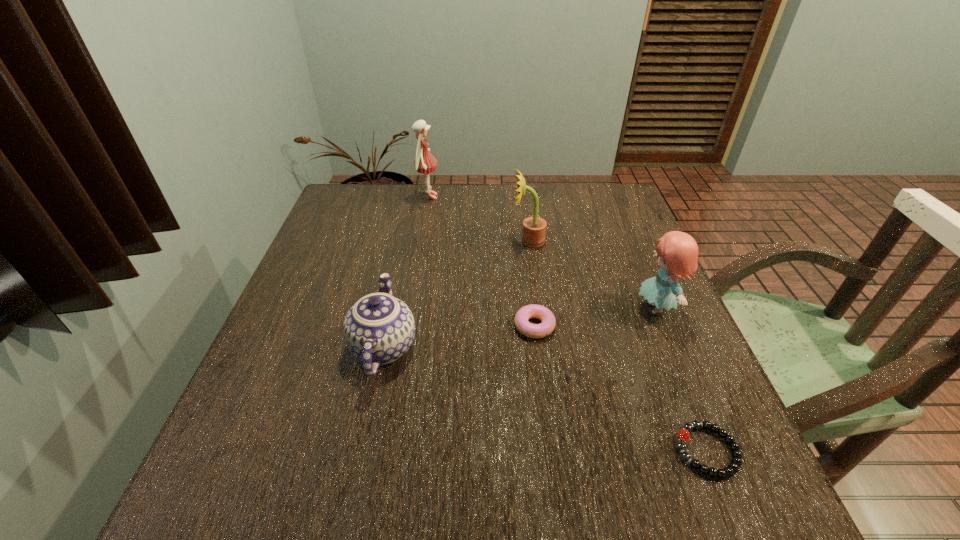
This screenshot has width=960, height=540. What are the coordinates of `free spot located 0.190m on the face of the second farthest object` in the screenshot? It's located at (443, 241).

At what (x,y) coordinates should I click in order to perform the action: click on free spot located 0.260m on the face of the second farthest object. Please return your answer as a coordinate pair (x, y). This screenshot has width=960, height=540. Looking at the image, I should click on (417, 241).

This screenshot has height=540, width=960. I want to click on vacant space located on the face of the second farthest object, so pyautogui.click(x=464, y=241).

Locate an element on the screen. Image resolution: width=960 pixels, height=540 pixels. vacant space located 0.240m on the front-facing side of the nearer doll is located at coordinates (530, 308).

At what (x,y) coordinates should I click in order to perform the action: click on vacant position located on the front-facing side of the nearer doll. Please return your answer as a coordinate pair (x, y). The image size is (960, 540). Looking at the image, I should click on (x=517, y=308).

You are a GUI agent. You are given a task and a screenshot of the screen. Output one action in this format:
    pyautogui.click(x=<x>, y=<y>)
    Task: Click on the free space located on the front-facing side of the nearer doll
    
    Given the screenshot: What is the action you would take?
    tap(582, 308)

The image size is (960, 540). What are the coordinates of `free space located at the spout of the third shortest object` in the screenshot? It's located at (396, 284).

Where is `vacant position located 0.150m at the spout of the third shortest object`? The height and width of the screenshot is (540, 960). vacant position located 0.150m at the spout of the third shortest object is located at coordinates (400, 266).

The width and height of the screenshot is (960, 540). In order to click on free space located at the spout of the third shortest object in this screenshot , I will do pos(407,237).

This screenshot has height=540, width=960. Find the location of `free space located on the front of the doughnut`. free space located on the front of the doughnut is located at coordinates (553, 470).